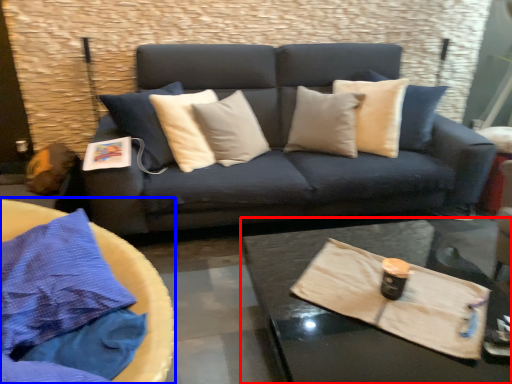
Question: Which object appears farthest to the camera in this image, coffee table (highlighted by a red box) or round table (highlighted by a blue box)?

Choices:
 (A) coffee table
 (B) round table

Answer: (A)